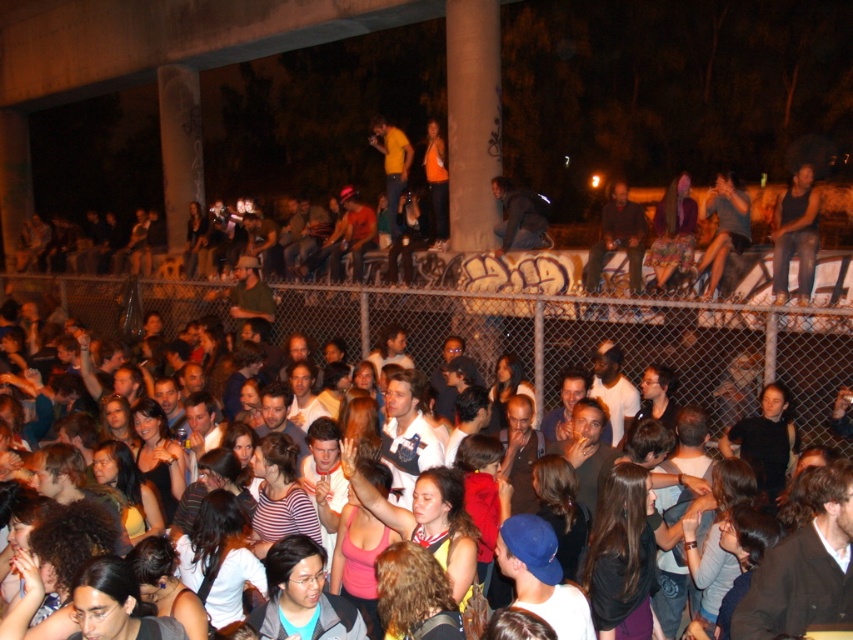
You are a photographer standing at the center of the crowd and want to capture an image of the point at coordinate point (795, 234). Since you have a wide angle lens, can you determine if the point is within your field of view?

The point (795, 234) is on black tank top at upper right, so it is within your field of view.

You are a photographer trying to capture a clear shot of both the black tank top at upper right and the matte black jacket at upper right. Since the two items are close to each other, you need to adjust your camera to focus on the wider one. Which one should you focus on?

The matte black jacket at upper right is wider than the black tank top at upper right, so you should focus on the matte black jacket at upper right to ensure clarity.

You are standing in the crowd at the lively outdoor event under the bridge. You notice two points marked in the scene. Which point is closer to you, point (618, 216) or point (727, 227)?

Point (618, 216) is further to the camera than point (727, 227), so the closer point to you is point (727, 227).